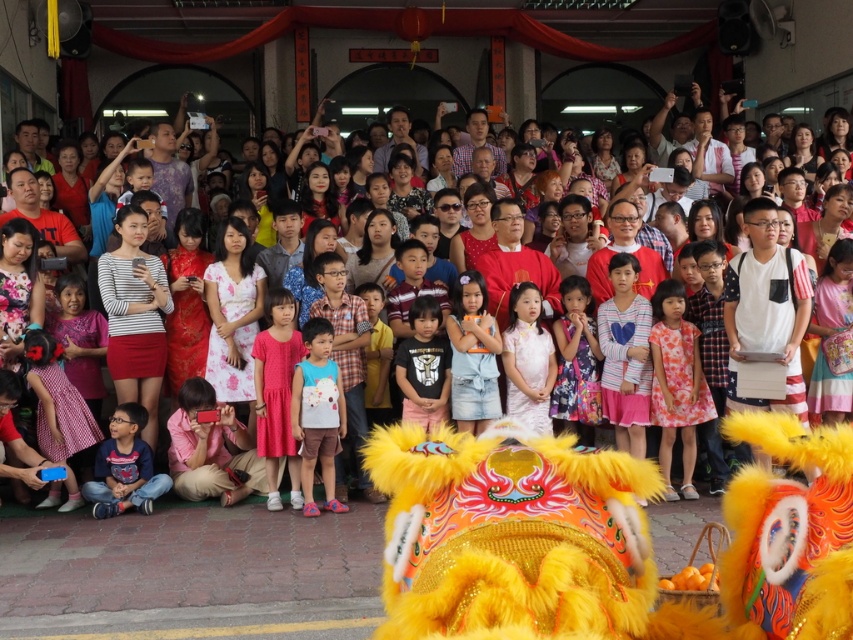
You are a photographer positioned at the back of the crowd. You want to take a photo of the white cotton shirt at center without the floral dress at center blocking it. Is this possible?

The floral dress at center is above the white cotton shirt at center, so it will block the view. Move to a position where you can see below the floral dress at center to capture the white cotton shirt at center without obstruction.